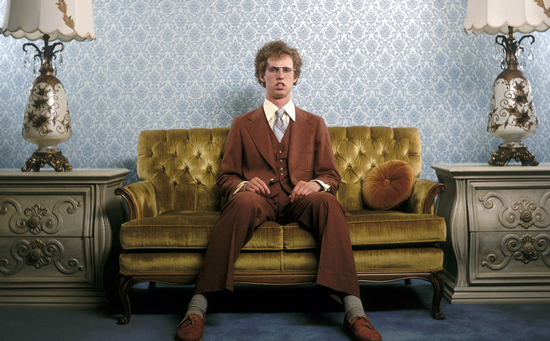
What are the coordinates of `side table` in the screenshot? It's located at (497, 202).